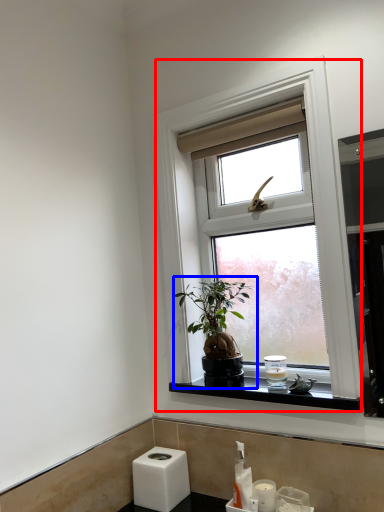
Question: Which object appears farthest to the camera in this image, window (highlighted by a red box) or houseplant (highlighted by a blue box)?

Choices:
 (A) window
 (B) houseplant

Answer: (B)